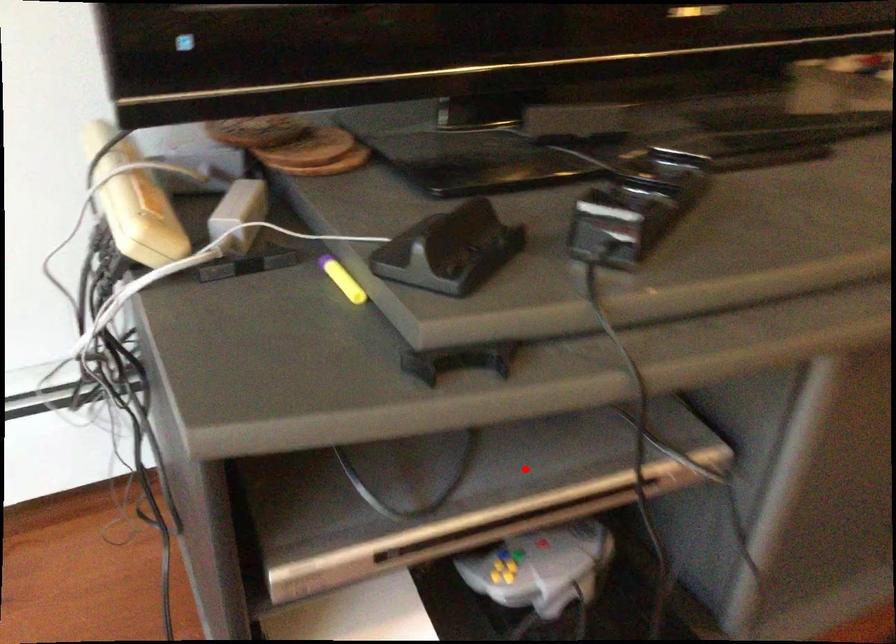
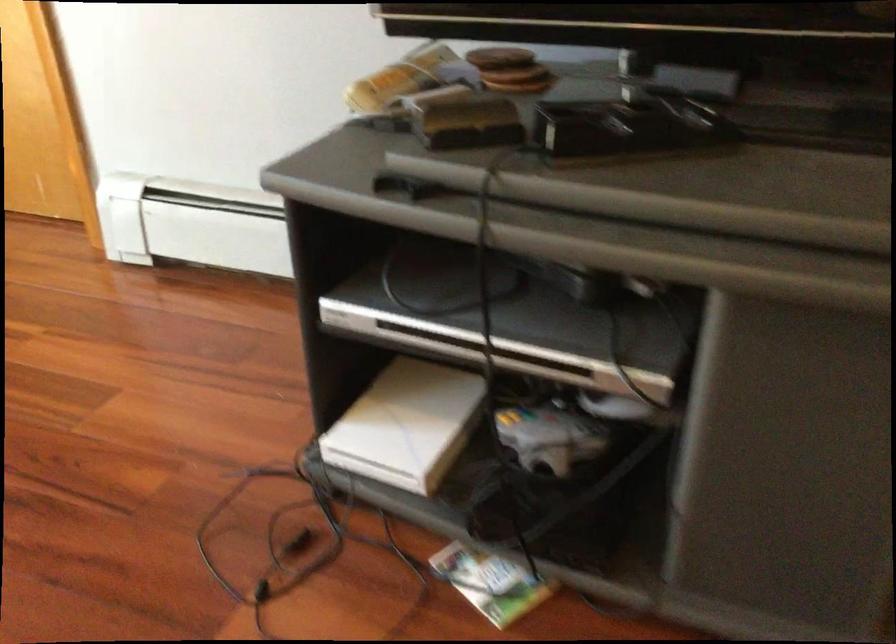
Find the pixel in the second image that matches the highlighted location in the first image.

(505, 321)